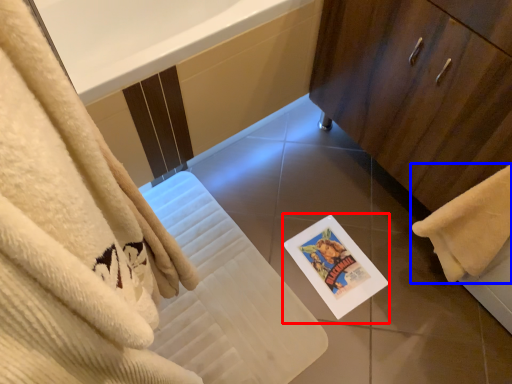
Question: Among these objects, which one is nearest to the camera, postcard (highlighted by a red box) or towel (highlighted by a blue box)?

Choices:
 (A) postcard
 (B) towel

Answer: (B)